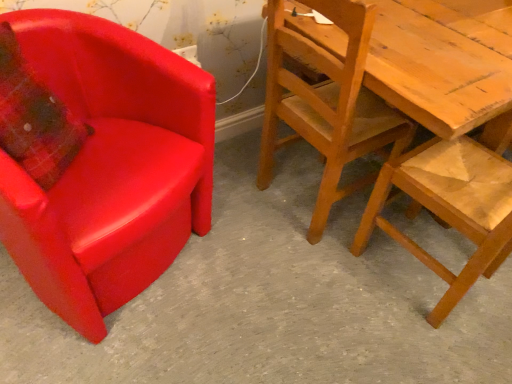
You are a GUI agent. You are given a task and a screenshot of the screen. Output one action in this format:
    pyautogui.click(x=<x>, y=<y>)
    Task: Click on the empty space that is ontop of matte plastic chair at left
    This screenshot has height=384, width=512.
    Given the screenshot: What is the action you would take?
    pos(286,276)